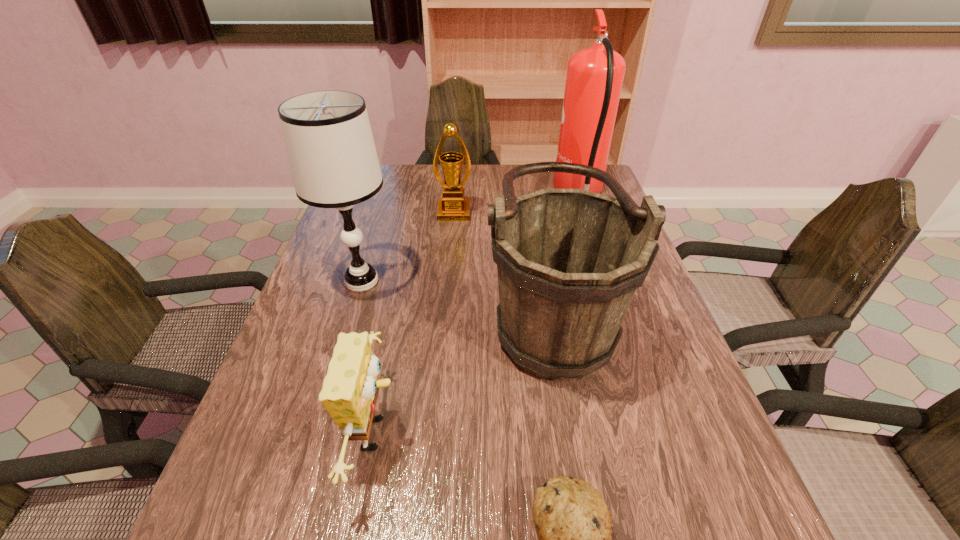
What are the coordinates of `free space located 0.210m on the handle side of the bucket` in the screenshot? It's located at (396, 313).

Where is `free region located on the handle side of the bucket`? This screenshot has height=540, width=960. free region located on the handle side of the bucket is located at coordinates (409, 313).

Locate an element on the screen. vacant area situated on the handle side of the bucket is located at coordinates (461, 313).

Identify the location of vacant space located on the front-facing side of the award. This screenshot has height=540, width=960. (450, 257).

Where is `free space located on the face of the second shortest object`? The height and width of the screenshot is (540, 960). free space located on the face of the second shortest object is located at coordinates (479, 434).

You are a GUI agent. You are given a task and a screenshot of the screen. Output one action in this format:
    pyautogui.click(x=<x>, y=<y>)
    Task: Click on the object that is at the far edge
    
    Given the screenshot: What is the action you would take?
    pyautogui.click(x=594, y=79)

Find the location of a particular element. The width and height of the screenshot is (960, 540). object that is at the left edge is located at coordinates (332, 155).

Find the location of a particular element. This screenshot has height=540, width=960. fire extinguisher that is at the right edge is located at coordinates (594, 79).

This screenshot has height=540, width=960. Identify the location of bucket that is positioned at the right edge. (569, 261).

Where is `object at the far right corner`? The height and width of the screenshot is (540, 960). object at the far right corner is located at coordinates (594, 79).